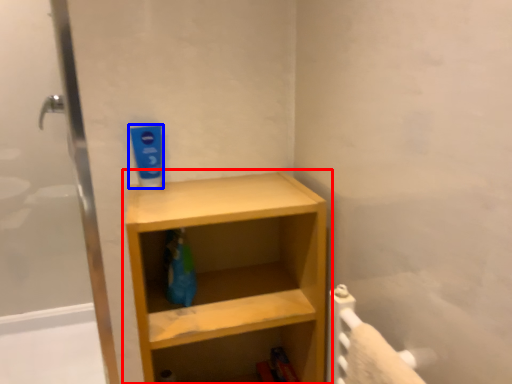
Question: Among these objects, which one is farthest to the camera, shelf (highlighted by a red box) or toothpaste (highlighted by a blue box)?

Choices:
 (A) shelf
 (B) toothpaste

Answer: (B)